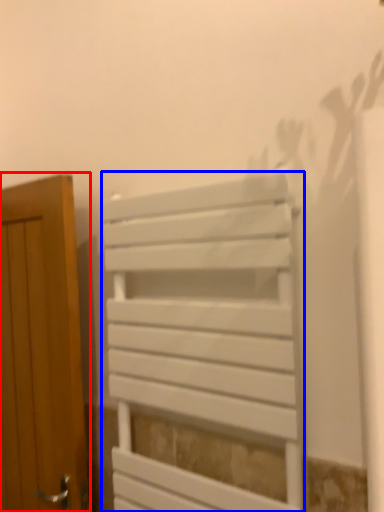
Question: Which point is closer to the camera, door (highlighted by a red box) or furniture (highlighted by a blue box)?

Choices:
 (A) door
 (B) furniture

Answer: (B)